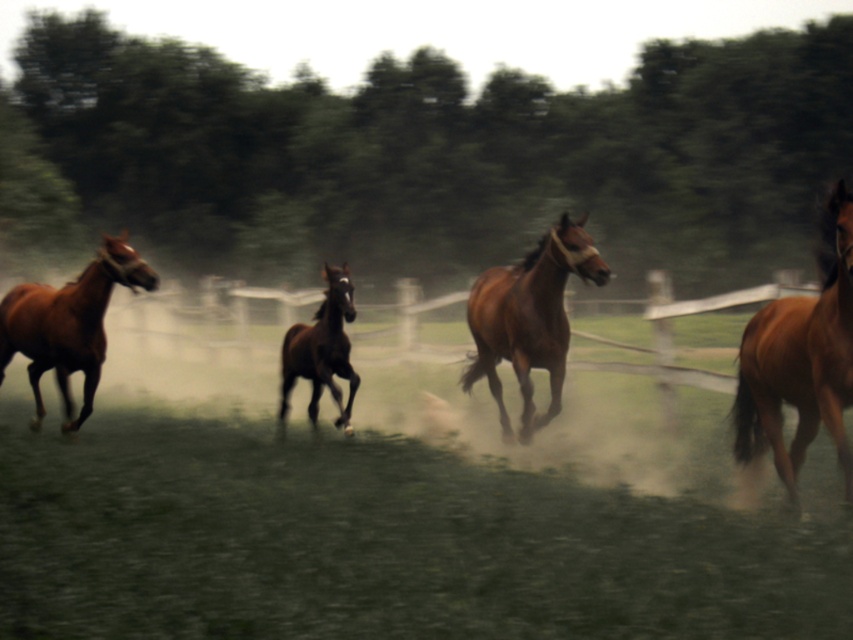
Between brown glossy horse at center and shiny brown horse at left, which one has less height?

With less height is shiny brown horse at left.

Can you confirm if brown glossy horse at center is positioned to the right of shiny brown horse at left?

Yes, brown glossy horse at center is to the right of shiny brown horse at left.

Does point (461, 380) lie behind point (3, 340)?

No, it is in front of (3, 340).

Identify the location of brown glossy horse at center. The height and width of the screenshot is (640, 853). click(x=529, y=317).

Measure the distance between point (x=838, y=371) and camera.

Point (x=838, y=371) and camera are 7.79 meters apart from each other.

Does brown glossy horse at right lie in front of brown glossy horse at center?

That is True.

Is point (844, 458) closer to camera compared to point (608, 275)?

Yes.

At what (x,y) coordinates should I click in order to perform the action: click on brown glossy horse at right. Please return your answer as a coordinate pair (x, y). The image size is (853, 640). Looking at the image, I should click on (801, 360).

Who is lower down, green leafy tree at center or brown glossy horse at center?

brown glossy horse at center is below.

Who is more forward, (795, 218) or (479, 275)?

Point (479, 275)

Where is `green leafy tree at center`? This screenshot has height=640, width=853. green leafy tree at center is located at coordinates (450, 150).

You are a GUI agent. You are given a task and a screenshot of the screen. Output one action in this format:
    pyautogui.click(x=<x>, y=<y>)
    Task: Click on the green leafy tree at center
    The height and width of the screenshot is (640, 853).
    Given the screenshot: What is the action you would take?
    pyautogui.click(x=450, y=150)